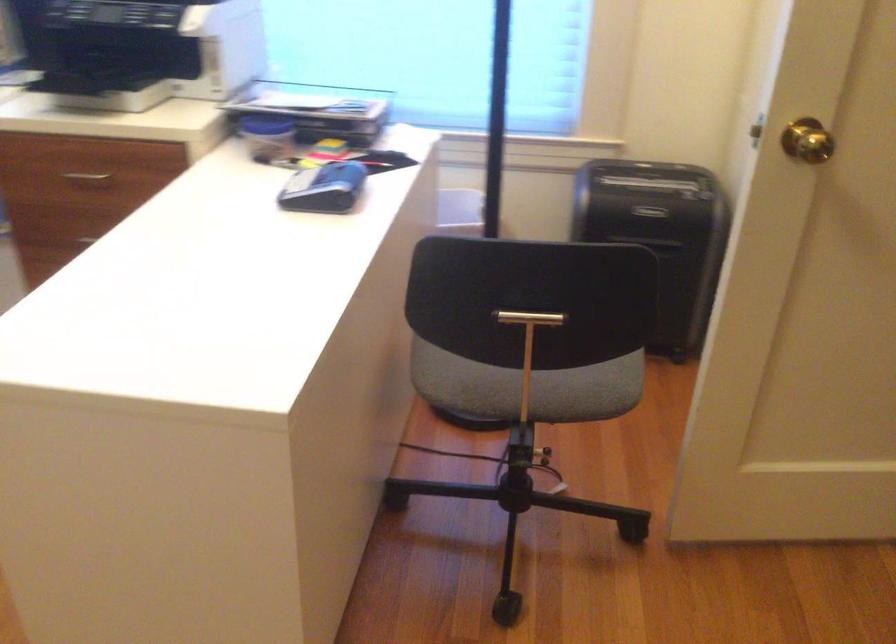
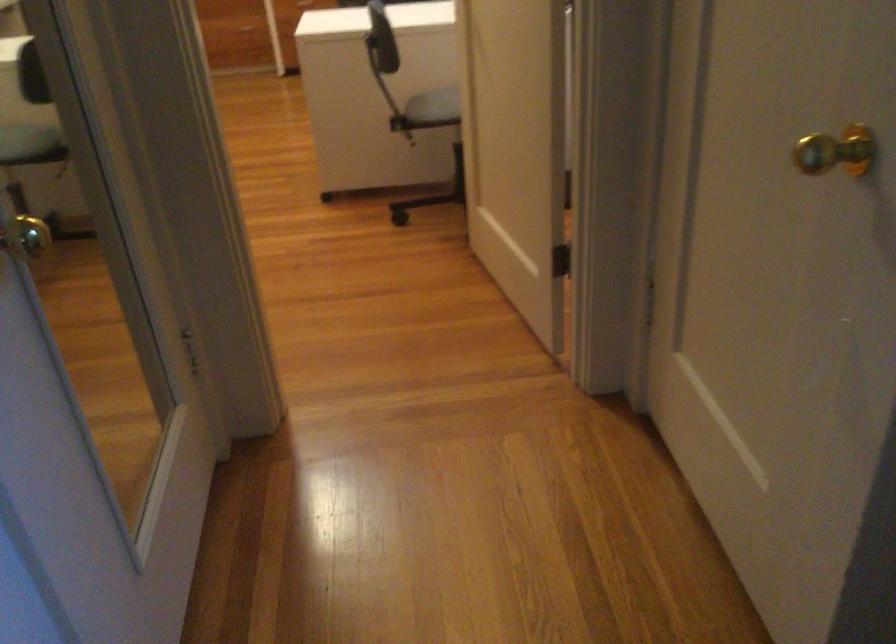
Locate, in the second image, the point that corresponds to (578,393) in the first image.

(434, 106)